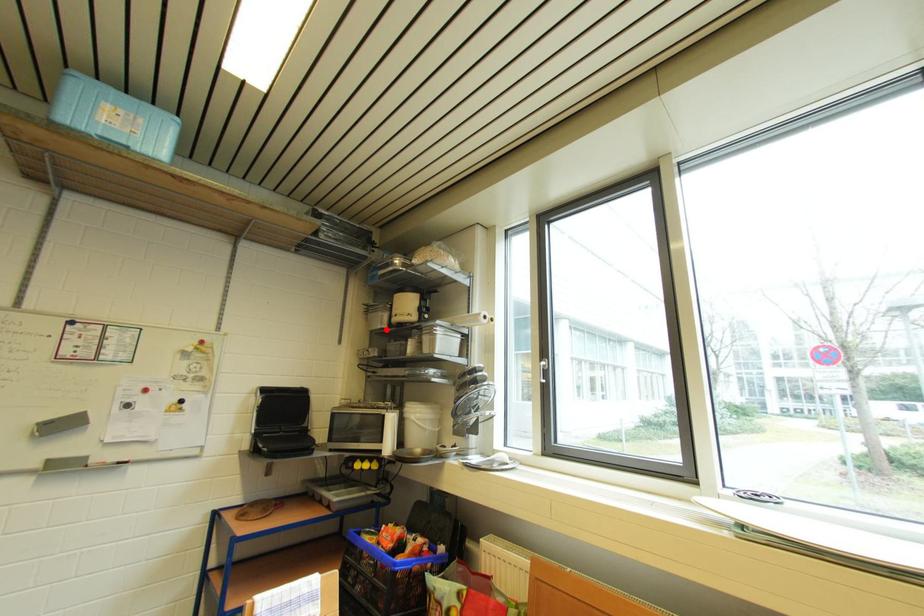
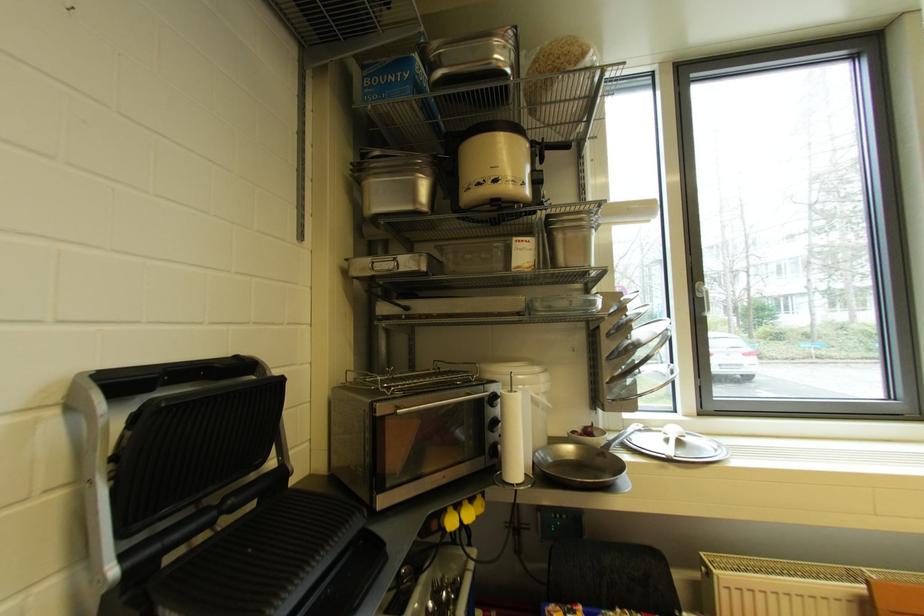
Find the pixel in the second image that matches the highlighted location in the first image.

(418, 211)